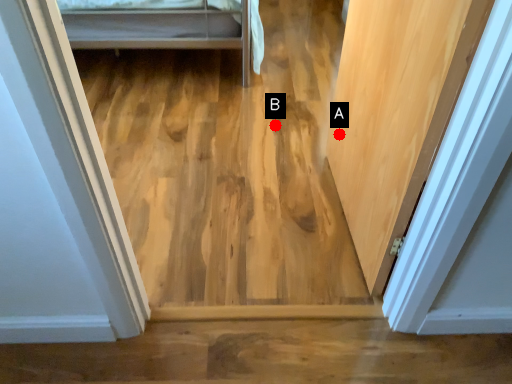
Question: Two points are circled on the image, labeled by A and B beside each circle. Which of the following is the farthest from the observer?

Choices:
 (A) A is further
 (B) B is further

Answer: (B)